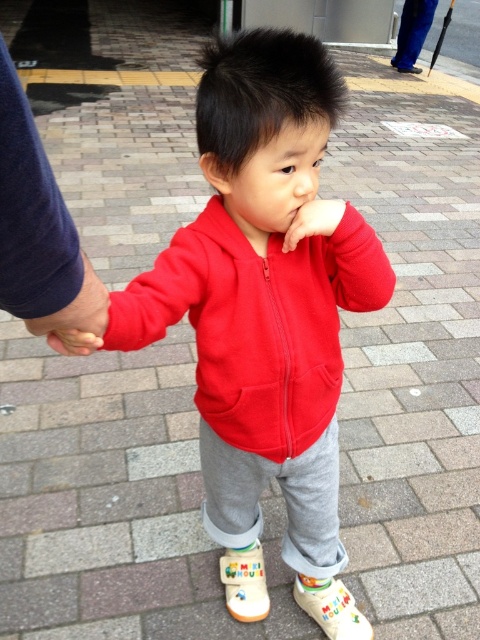
Does blue fabric hand at left lie in front of white rubber shoe at lower right?

Yes, blue fabric hand at left is in front of white rubber shoe at lower right.

Does point (74, 304) come farther from viewer compared to point (405, 67)?

That is False.

Where is `blue fabric hand at left`? The image size is (480, 640). blue fabric hand at left is located at coordinates (76, 317).

Does blue fabric hand at left lie in front of white rubber boot at lower center?

Yes, blue fabric hand at left is closer to the viewer.

Does blue fabric hand at left have a greater width compared to white rubber boot at lower center?

In fact, blue fabric hand at left might be narrower than white rubber boot at lower center.

Where is `blue fabric hand at left`? Image resolution: width=480 pixels, height=640 pixels. blue fabric hand at left is located at coordinates (76, 317).

Can you confirm if matte fleece jacket at center is shorter than white fabric shoe at lower right?

No, matte fleece jacket at center is not shorter than white fabric shoe at lower right.

Find the location of a particular element. The width and height of the screenshot is (480, 640). matte fleece jacket at center is located at coordinates [257, 323].